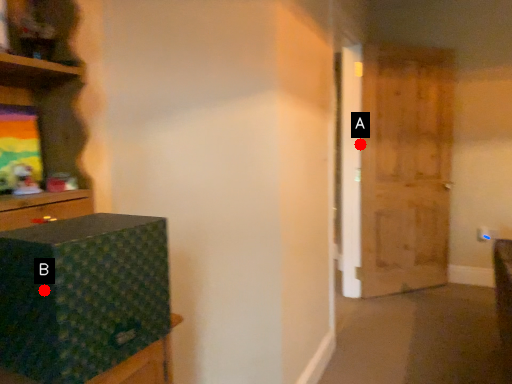
Question: Two points are circled on the image, labeled by A and B beside each circle. Among these points, which one is nearest to the camera?

Choices:
 (A) A is closer
 (B) B is closer

Answer: (B)